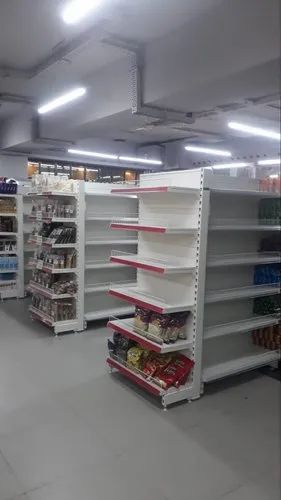
The width and height of the screenshot is (281, 500). I want to click on stocked shelves, so click(x=135, y=378), click(x=137, y=336).